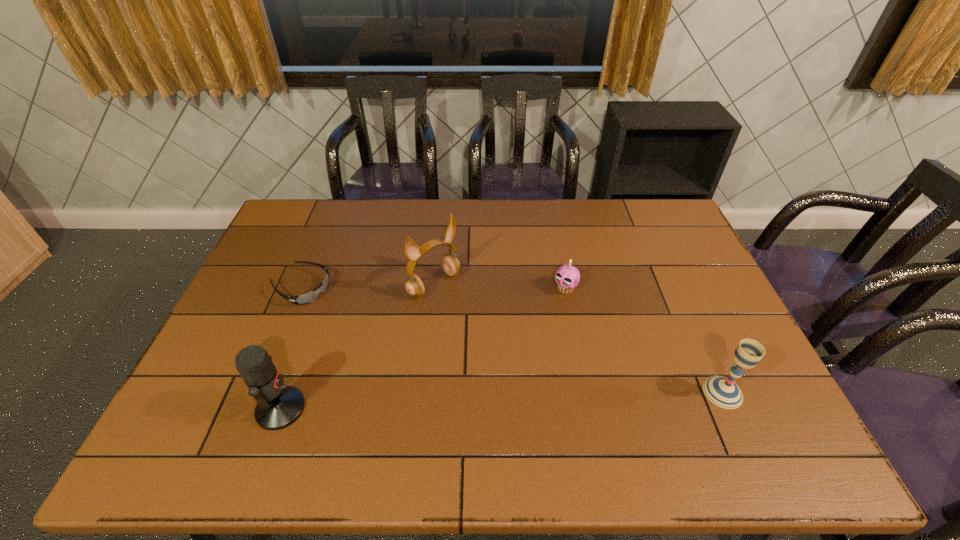
Image resolution: width=960 pixels, height=540 pixels. Identify the location of free space on the desktop that is between the microphone and the chalice and is positioned on the front-facing side of the third object from left to right. (566, 398).

At what (x,y) coordinates should I click in order to perform the action: click on vacant space on the desktop that is between the microphone and the third shortest object and is positioned on the face of the cupcake. Please return your answer as a coordinate pair (x, y). The height and width of the screenshot is (540, 960). Looking at the image, I should click on (452, 402).

Identify the location of vacant spot on the desktop that is between the microphone and the rightmost object and is positioned on the lenses of the sunglasses. (517, 400).